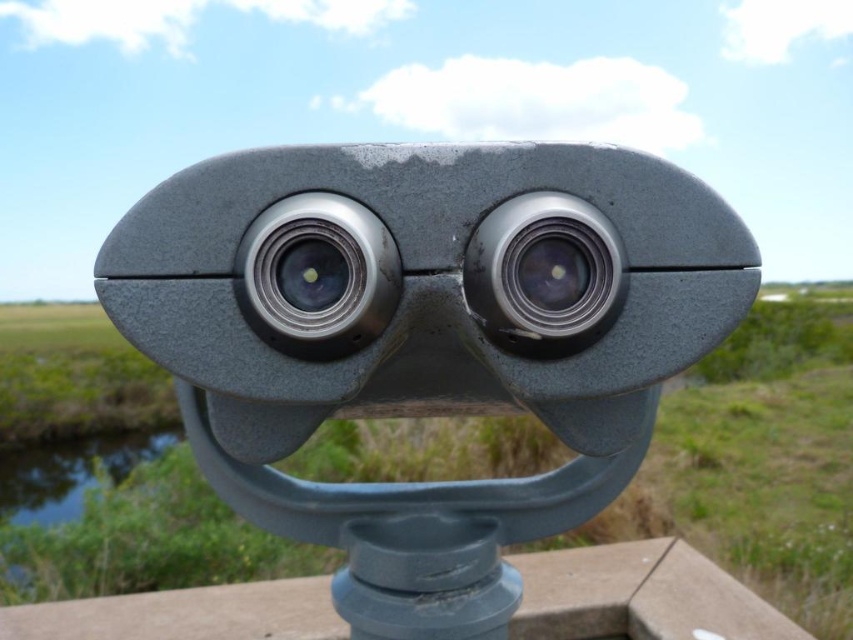
From the picture: You are a photographer trying to capture a clear image through the binoculars. You notice the matte gray telescope at center and the satin silver lens at center. Which object should you adjust first to ensure proper focus?

The satin silver lens at center should be adjusted first because the matte gray telescope at center is much taller than the satin silver lens at center, meaning the lens is the smaller component and likely requires alignment for focus.

You are a photographer trying to capture the landscape through the binoculars. Since the matte gray telescope at center and the metallic silver lens at center are both in your view, which one would block more of the background landscape when you take the photo?

The matte gray telescope at center is bigger than the metallic silver lens at center, so it would block more of the background landscape in the photo.

You are a photographer holding a camera that requires you to be at least 15 inches away from the subject to focus properly. You want to take a photo of the matte gray telescope at center. Based on the scene, can you focus on the telescope with your current position?

The matte gray telescope at center is 14.33 inches from viewer. Since your camera requires at least 15 inches to focus, you need to move back approximately 0.67 inches to achieve proper focus.